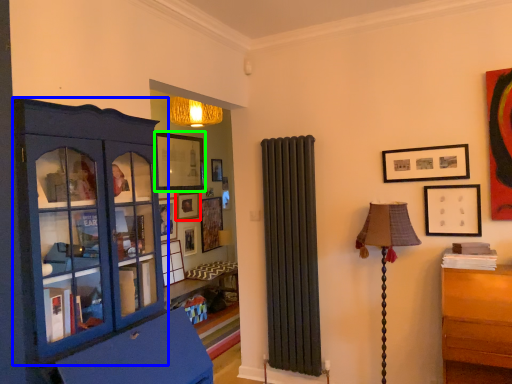
Question: Considering the real-world distances, which object is closest to picture frame (highlighted by a red box)? cabinetry (highlighted by a blue box) or picture frame (highlighted by a green box).

Choices:
 (A) cabinetry
 (B) picture frame

Answer: (B)